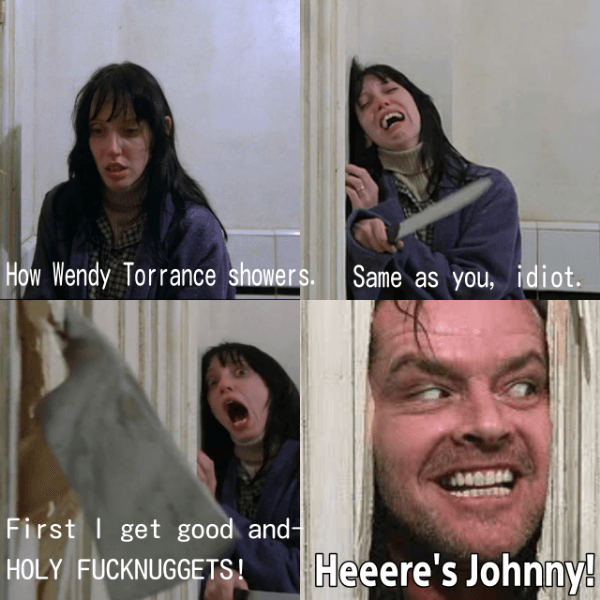
What are the coordinates of `wall` in the screenshot? It's located at (242, 108), (529, 101), (266, 321).